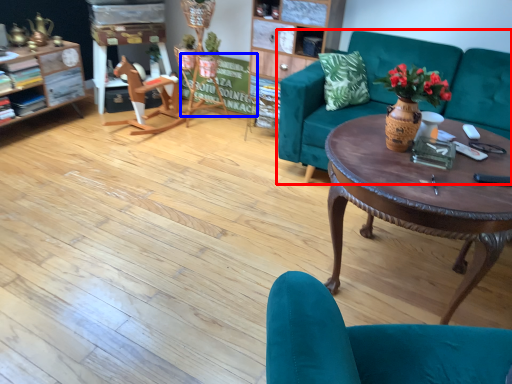
Question: Among these objects, which one is farthest to the camera, studio couch (highlighted by a red box) or bulletin board (highlighted by a blue box)?

Choices:
 (A) studio couch
 (B) bulletin board

Answer: (B)